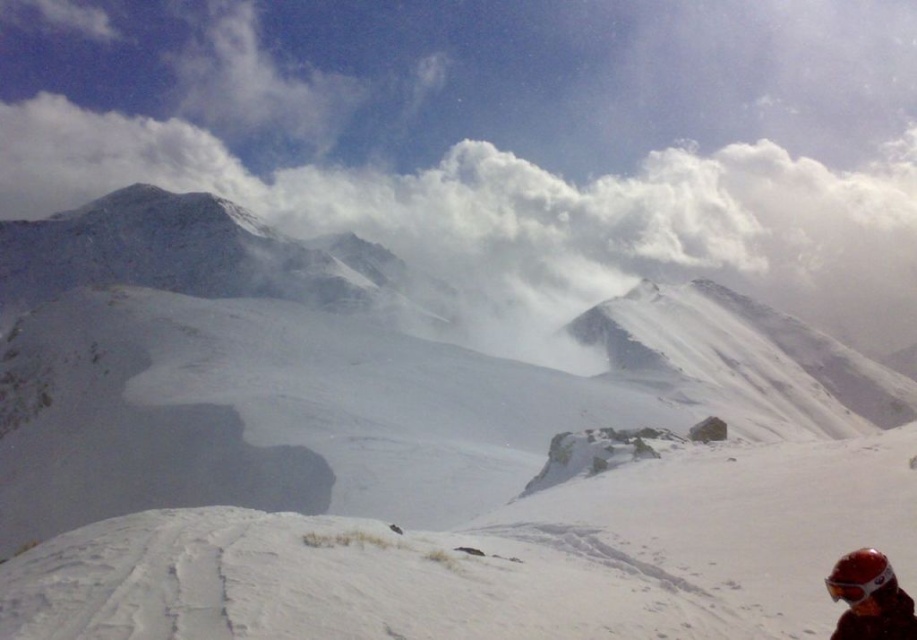
Does white fluffy cloud at upper center appear over matte red goggles at lower right?

Correct, white fluffy cloud at upper center is located above matte red goggles at lower right.

Image resolution: width=917 pixels, height=640 pixels. In order to click on white fluffy cloud at upper center in this screenshot , I will do `click(534, 216)`.

I want to click on white fluffy cloud at upper center, so click(x=534, y=216).

Can you confirm if white fluffy cloud at upper center is taller than matte orange helmet at lower right?

Yes, white fluffy cloud at upper center is taller than matte orange helmet at lower right.

Measure the distance from white fluffy cloud at upper center to matte orange helmet at lower right.

A distance of 2129.02 feet exists between white fluffy cloud at upper center and matte orange helmet at lower right.

Does point (612, 209) come in front of point (869, 609)?

No.

The width and height of the screenshot is (917, 640). I want to click on white fluffy cloud at upper center, so click(x=534, y=216).

Who is more distant from viewer, (868, 547) or (858, 589)?

The point (868, 547) is behind.

Image resolution: width=917 pixels, height=640 pixels. What are the coordinates of `matte orange helmet at lower right` in the screenshot? It's located at (869, 598).

Image resolution: width=917 pixels, height=640 pixels. In order to click on matte orange helmet at lower right in this screenshot , I will do coord(869,598).